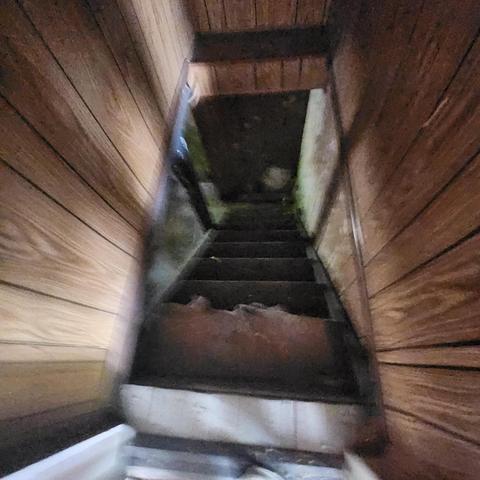
Locate an element on the screen. left most wall wood is located at coordinates (32, 204).